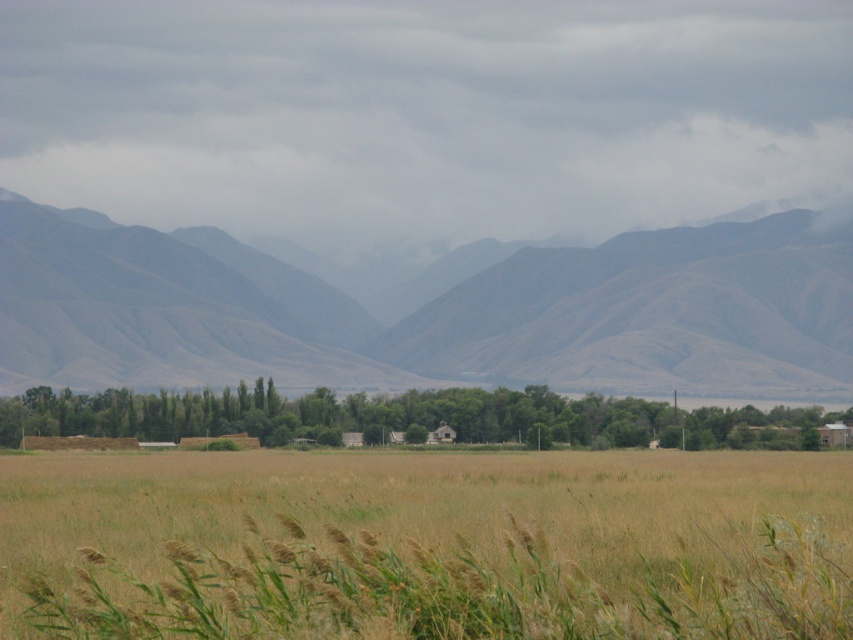
Which is behind, point (149, 369) or point (621, 420)?

The point (149, 369) is behind.

Between gray textured mountains at center and green leafy trees at center, which one is positioned lower?

green leafy trees at center is below.

Image resolution: width=853 pixels, height=640 pixels. Find the location of `gray textured mountains at center`. gray textured mountains at center is located at coordinates (430, 312).

At what (x,y) coordinates should I click in order to perform the action: click on gray textured mountains at center. Please return your answer as a coordinate pair (x, y). Looking at the image, I should click on (430, 312).

Does point (474, 596) come closer to viewer compared to point (157, 412)?

Yes, it is.

Does brown grassland at center appear over green leafy trees at center?

Correct, brown grassland at center is located above green leafy trees at center.

Is point (171, 500) positioned after point (548, 406)?

That is False.

This screenshot has height=640, width=853. What are the coordinates of `brown grassland at center` in the screenshot? It's located at (425, 547).

Can you confirm if brown grassland at center is bigger than gray textured mountains at center?

Actually, brown grassland at center might be smaller than gray textured mountains at center.

Is point (816, 556) farther from viewer compared to point (822, 355)?

No.

Find the location of a particular element. brown grassland at center is located at coordinates click(425, 547).